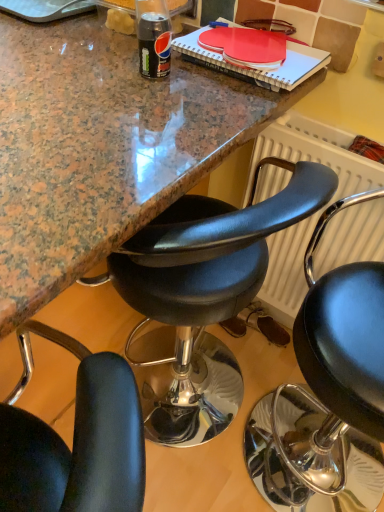
Question: Does black leather chair at center, which is the second chair from left to right, come behind black leather chair at center, arranged as the first chair when viewed from the left?

Choices:
 (A) no
 (B) yes

Answer: (A)

Question: Could you tell me if black leather chair at center, which is the second chair from left to right, is facing black leather chair at center, arranged as the first chair when viewed from the left?

Choices:
 (A) no
 (B) yes

Answer: (B)

Question: Is black leather chair at center, the 1th chair viewed from the right, positioned beyond the bounds of black leather chair at center, positioned as the second chair in right-to-left order?

Choices:
 (A) yes
 (B) no

Answer: (A)

Question: Is black leather chair at center, the 1th chair viewed from the right, at the right side of black leather chair at center, arranged as the first chair when viewed from the left?

Choices:
 (A) no
 (B) yes

Answer: (B)

Question: Considering the relative positions of black leather chair at center, the 1th chair viewed from the right, and black leather chair at center, arranged as the first chair when viewed from the left, in the image provided, is black leather chair at center, the 1th chair viewed from the right, to the left of black leather chair at center, arranged as the first chair when viewed from the left, from the viewer's perspective?

Choices:
 (A) no
 (B) yes

Answer: (A)

Question: From a real-world perspective, is white textured radiator at right physically located above or below black leather chair at center, the 1th chair viewed from the right?

Choices:
 (A) above
 (B) below

Answer: (A)

Question: Is white textured radiator at right bigger or smaller than black leather chair at center, the 1th chair viewed from the right?

Choices:
 (A) big
 (B) small

Answer: (B)

Question: Considering the positions of white textured radiator at right and black leather chair at center, which is the second chair from left to right, in the image, is white textured radiator at right taller or shorter than black leather chair at center, which is the second chair from left to right,?

Choices:
 (A) short
 (B) tall

Answer: (A)

Question: Is white textured radiator at right wider or thinner than black leather chair at center, the 1th chair viewed from the right?

Choices:
 (A) thin
 (B) wide

Answer: (A)

Question: In terms of width, does white textured radiator at right look wider or thinner when compared to black leather chair at center, arranged as the first chair when viewed from the left?

Choices:
 (A) thin
 (B) wide

Answer: (A)

Question: Is point (322, 161) closer or farther from the camera than point (170, 409)?

Choices:
 (A) farther
 (B) closer

Answer: (B)

Question: From the image's perspective, relative to black leather chair at center, positioned as the second chair in right-to-left order, is white textured radiator at right above or below?

Choices:
 (A) above
 (B) below

Answer: (A)

Question: Looking at the image, does white textured radiator at right seem bigger or smaller compared to black leather chair at center, arranged as the first chair when viewed from the left?

Choices:
 (A) small
 (B) big

Answer: (A)

Question: Is point (337, 302) positioned closer to the camera than point (317, 245)?

Choices:
 (A) farther
 (B) closer

Answer: (B)

Question: Looking at their shapes, would you say black leather chair at center, the 1th chair viewed from the right, is wider or thinner than white textured radiator at right?

Choices:
 (A) wide
 (B) thin

Answer: (A)